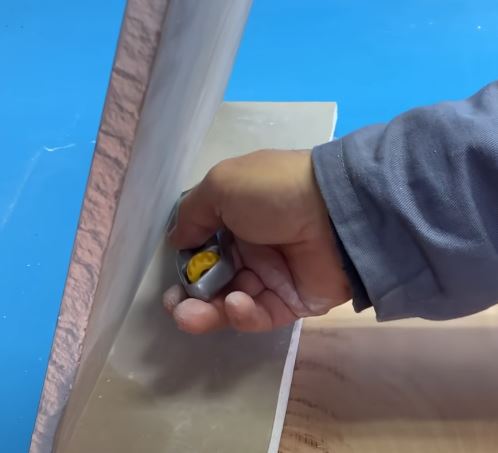
You are a GUI agent. You are given a task and a screenshot of the screen. Output one action in this format:
    pyautogui.click(x=<x>, y=<y>)
    Task: Click on the dark splotches on gray sheetrock
    The image size is (498, 453).
    Given the screenshot: What is the action you would take?
    pyautogui.click(x=107, y=389)